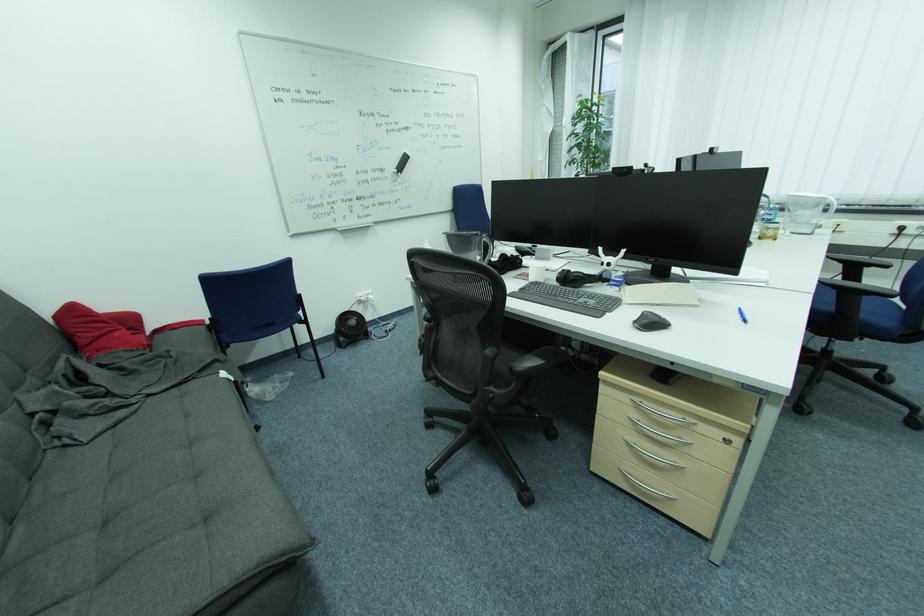
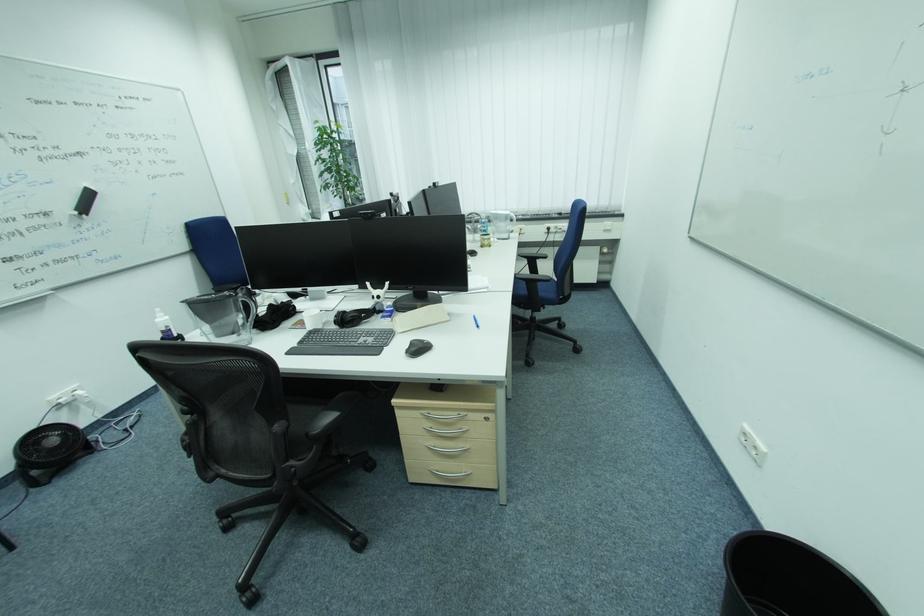
Where in the second image is the point corresponding to point (847, 262) from the first image?

(531, 257)